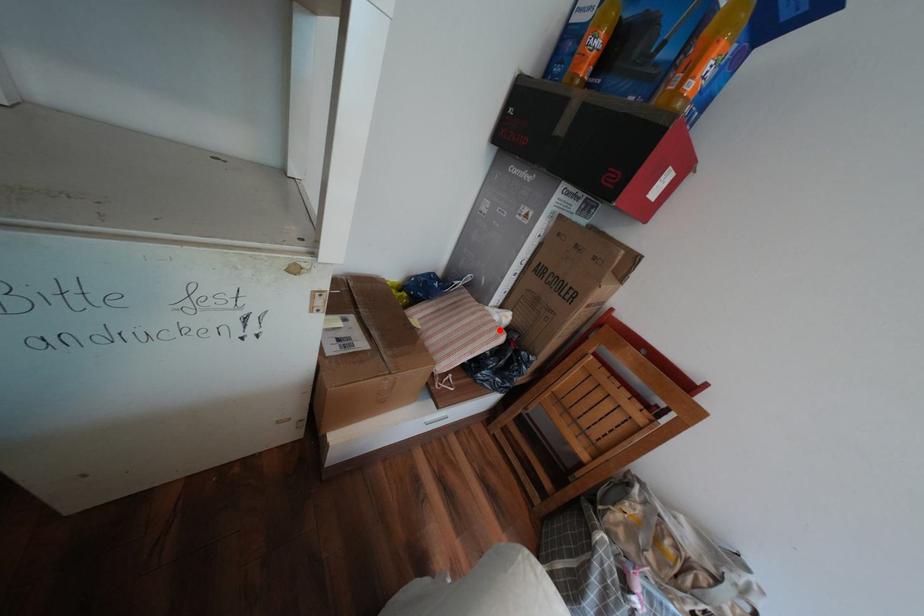
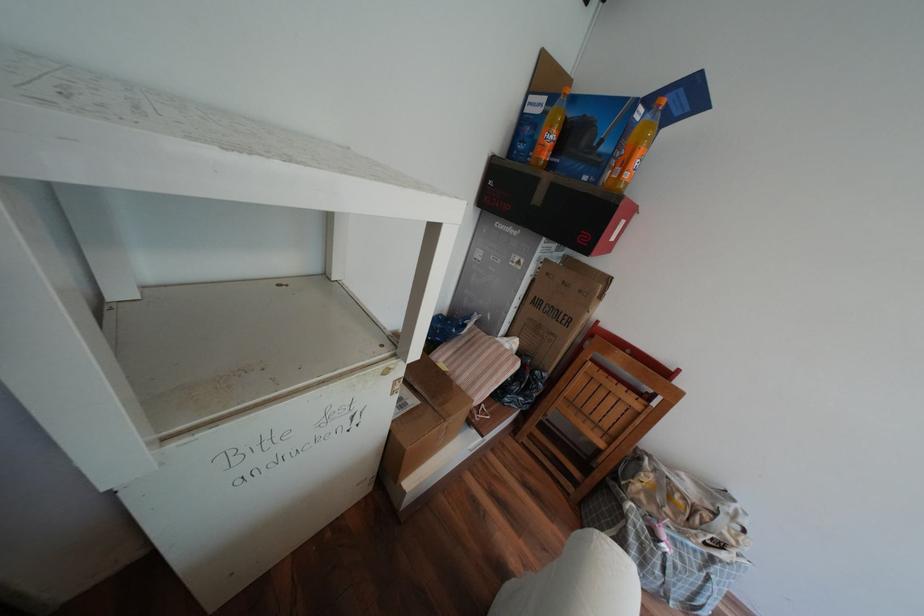
In the second image, find the point that corresponds to the highlighted location in the first image.

(517, 360)